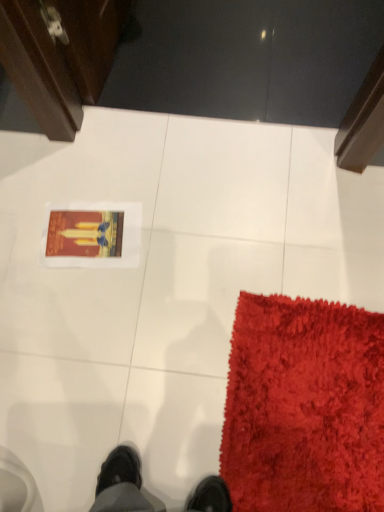
What is the approximate height of shaggy red rug at lower right?

shaggy red rug at lower right is 1.28 inches tall.

I want to click on shaggy red rug at lower right, so click(304, 407).

What do you see at coordinates (304, 407) in the screenshot? I see `shaggy red rug at lower right` at bounding box center [304, 407].

The height and width of the screenshot is (512, 384). I want to click on shaggy red rug at lower right, so click(x=304, y=407).